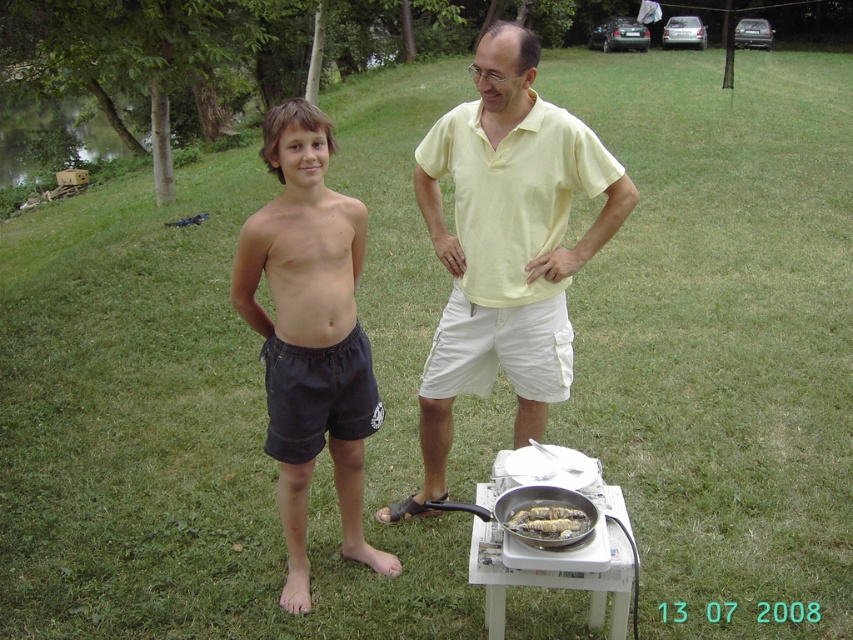
Question: Can you confirm if yellow cotton shirt at center is wider than silver metallic frying pan at lower center?

Choices:
 (A) yes
 (B) no

Answer: (A)

Question: Which object is the closest to the brown crispy fish at lower center?

Choices:
 (A) yellow cotton shirt at center
 (B) silver metallic frying pan at lower center

Answer: (B)

Question: Considering the relative positions of dark cotton shorts at center and brown crispy fish at lower center in the image provided, where is dark cotton shorts at center located with respect to brown crispy fish at lower center?

Choices:
 (A) right
 (B) left

Answer: (B)

Question: Can you confirm if yellow cotton shirt at center is thinner than dark cotton shorts at center?

Choices:
 (A) yes
 (B) no

Answer: (B)

Question: Which object is farther from the camera taking this photo?

Choices:
 (A) dark cotton shorts at center
 (B) yellow cotton shirt at center
 (C) silver metallic frying pan at lower center
 (D) brown crispy fish at lower center

Answer: (B)

Question: Among these objects, which one is nearest to the camera?

Choices:
 (A) silver metallic frying pan at lower center
 (B) dark blue shorts at center
 (C) dark cotton shorts at center
 (D) yellow cotton shirt at center

Answer: (A)